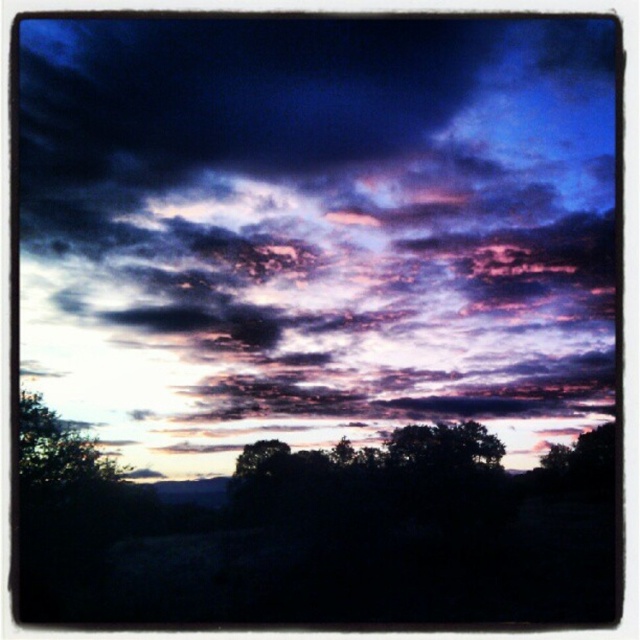
Is purple cotton clouds at upper center closer to camera compared to dark green leafy tree at center?

Yes.

Can you confirm if purple cotton clouds at upper center is wider than dark green leafy tree at center?

Correct, the width of purple cotton clouds at upper center exceeds that of dark green leafy tree at center.

Which is behind, point (141, 97) or point (422, 460)?

The point (422, 460) is more distant.

Locate an element on the screen. purple cotton clouds at upper center is located at coordinates (316, 228).

Is green leafy tree at lower left shorter than dark green leafy tree at center?

No, green leafy tree at lower left is not shorter than dark green leafy tree at center.

Between green leafy tree at lower left and dark green leafy tree at center, which one has more height?

Standing taller between the two is green leafy tree at lower left.

Identify the location of green leafy tree at lower left. Image resolution: width=640 pixels, height=640 pixels. (58, 454).

The height and width of the screenshot is (640, 640). What are the coordinates of `green leafy tree at lower left` in the screenshot? It's located at (58, 454).

Between purple cotton clouds at upper center and green leafy tree at lower left, which one is positioned lower?

green leafy tree at lower left

Image resolution: width=640 pixels, height=640 pixels. What do you see at coordinates (316, 228) in the screenshot?
I see `purple cotton clouds at upper center` at bounding box center [316, 228].

This screenshot has width=640, height=640. In order to click on purple cotton clouds at upper center in this screenshot , I will do `click(316, 228)`.

The height and width of the screenshot is (640, 640). Find the location of `purple cotton clouds at upper center`. purple cotton clouds at upper center is located at coordinates (316, 228).